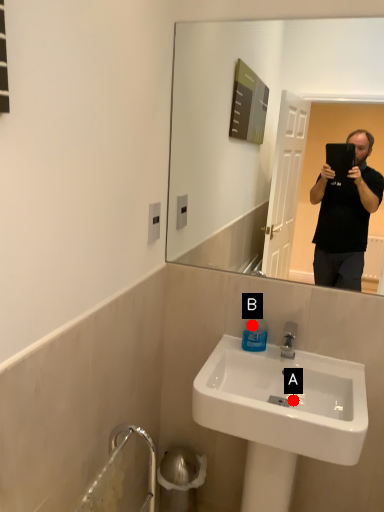
Question: Two points are circled on the image, labeled by A and B beside each circle. Which point is closer to the camera taking this photo?

Choices:
 (A) A is closer
 (B) B is closer

Answer: (A)